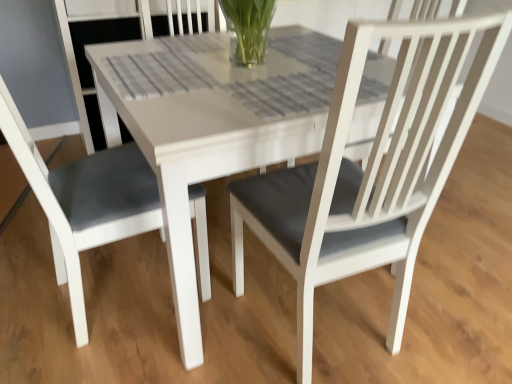
Question: Is matte gray cushion at left thinner than white matte table at center?

Choices:
 (A) yes
 (B) no

Answer: (A)

Question: Is matte gray cushion at left at the left side of white matte table at center?

Choices:
 (A) no
 (B) yes

Answer: (B)

Question: From the image's perspective, is matte gray cushion at left on white matte table at center?

Choices:
 (A) yes
 (B) no

Answer: (B)

Question: Is matte gray cushion at left far away from white matte table at center?

Choices:
 (A) yes
 (B) no

Answer: (B)

Question: Does matte gray cushion at left have a larger size compared to white matte table at center?

Choices:
 (A) yes
 (B) no

Answer: (B)

Question: Does matte gray cushion at left contain white matte table at center?

Choices:
 (A) yes
 (B) no

Answer: (B)

Question: Does white matte table at center come in front of matte gray cushion at left?

Choices:
 (A) yes
 (B) no

Answer: (B)

Question: Can you confirm if white matte table at center is shorter than matte gray cushion at left?

Choices:
 (A) no
 (B) yes

Answer: (B)

Question: From the image's perspective, is white matte table at center on top of matte gray cushion at left?

Choices:
 (A) yes
 (B) no

Answer: (A)

Question: Is white matte table at center turned away from matte gray cushion at left?

Choices:
 (A) no
 (B) yes

Answer: (A)

Question: From a real-world perspective, is white matte table at center over matte gray cushion at left?

Choices:
 (A) yes
 (B) no

Answer: (B)

Question: From a real-world perspective, does white matte table at center sit lower than matte gray cushion at left?

Choices:
 (A) no
 (B) yes

Answer: (B)

Question: Is white matte table at center taller or shorter than matte gray cushion at left?

Choices:
 (A) short
 (B) tall

Answer: (A)